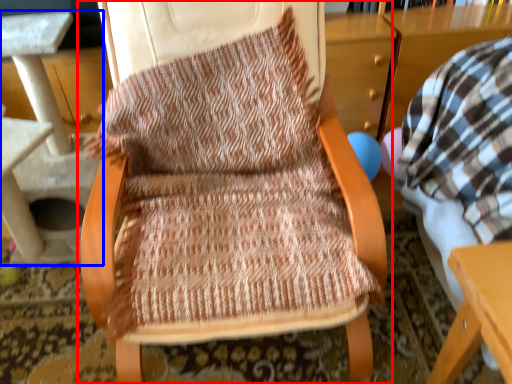
Question: Among these objects, which one is nearest to the camera, chair (highlighted by a red box) or table (highlighted by a blue box)?

Choices:
 (A) chair
 (B) table

Answer: (A)